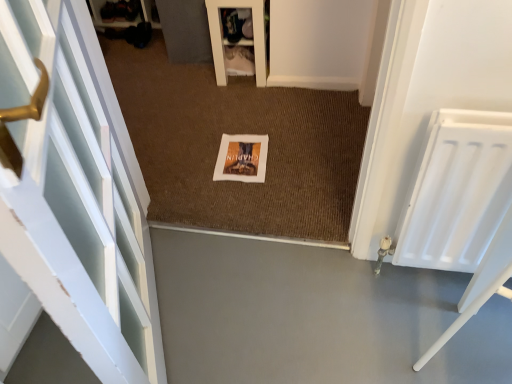
You are a GUI agent. You are given a task and a screenshot of the screen. Output one action in this format:
    pyautogui.click(x=<x>, y=<y>)
    Task: Click on the blank space to the left of white matte picture frame at center
    
    Given the screenshot: What is the action you would take?
    pyautogui.click(x=189, y=160)